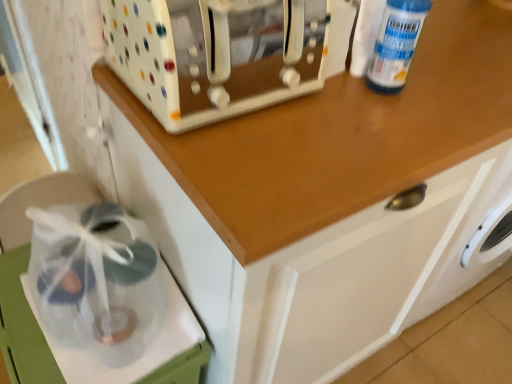
Question: Is white glossy toaster at upper center facing towards clear plastic bag at lower left?

Choices:
 (A) yes
 (B) no

Answer: (B)

Question: Can we say white glossy toaster at upper center lies outside clear plastic bag at lower left?

Choices:
 (A) no
 (B) yes

Answer: (B)

Question: Is clear plastic bag at lower left a part of white glossy toaster at upper center?

Choices:
 (A) yes
 (B) no

Answer: (B)

Question: Considering the relative sizes of white glossy toaster at upper center and clear plastic bag at lower left in the image provided, is white glossy toaster at upper center taller than clear plastic bag at lower left?

Choices:
 (A) no
 (B) yes

Answer: (B)

Question: From the image's perspective, is white glossy toaster at upper center under clear plastic bag at lower left?

Choices:
 (A) yes
 (B) no

Answer: (B)

Question: Considering their positions, is clear plastic bottle at upper right located in front of or behind clear plastic bag at lower left?

Choices:
 (A) front
 (B) behind

Answer: (A)

Question: From the image's perspective, is clear plastic bottle at upper right positioned above or below clear plastic bag at lower left?

Choices:
 (A) above
 (B) below

Answer: (A)

Question: Considering the positions of point (375, 66) and point (188, 377), is point (375, 66) closer or farther from the camera than point (188, 377)?

Choices:
 (A) closer
 (B) farther

Answer: (A)

Question: In terms of size, does clear plastic bottle at upper right appear bigger or smaller than clear plastic bag at lower left?

Choices:
 (A) big
 (B) small

Answer: (B)

Question: From a real-world perspective, is white glossy toaster at upper center positioned above or below clear plastic bottle at upper right?

Choices:
 (A) below
 (B) above

Answer: (A)

Question: From their relative heights in the image, would you say white glossy toaster at upper center is taller or shorter than clear plastic bottle at upper right?

Choices:
 (A) tall
 (B) short

Answer: (B)

Question: Looking at the image, does white glossy toaster at upper center seem bigger or smaller compared to clear plastic bottle at upper right?

Choices:
 (A) big
 (B) small

Answer: (A)

Question: Would you say white glossy toaster at upper center is to the left or to the right of clear plastic bottle at upper right in the picture?

Choices:
 (A) right
 (B) left

Answer: (B)

Question: From a real-world perspective, is white glossy toaster at upper center physically located above or below clear plastic bag at lower left?

Choices:
 (A) below
 (B) above

Answer: (B)

Question: Considering the positions of white glossy toaster at upper center and clear plastic bag at lower left in the image, is white glossy toaster at upper center wider or thinner than clear plastic bag at lower left?

Choices:
 (A) thin
 (B) wide

Answer: (A)